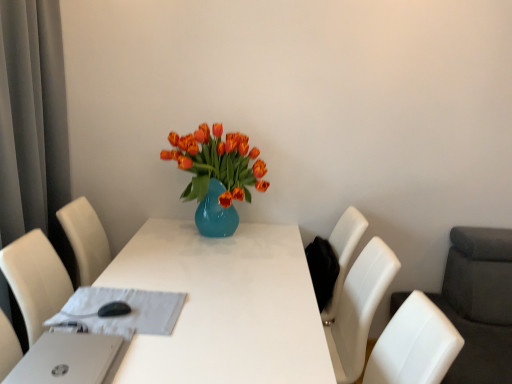
Find the location of `free space above white fabric at center (from a real-world perspective)`. free space above white fabric at center (from a real-world perspective) is located at coordinates (120, 307).